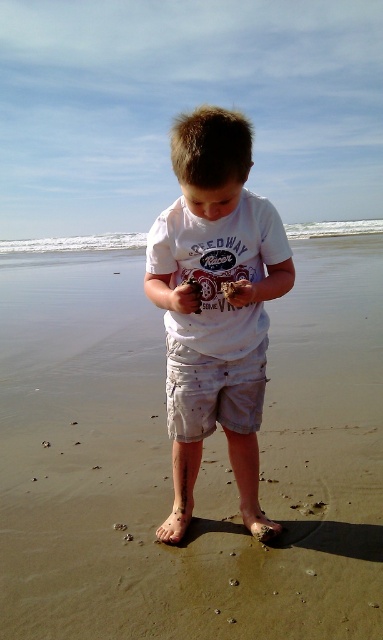
This screenshot has width=383, height=640. What do you see at coordinates (212, 392) in the screenshot?
I see `white cotton shorts at center` at bounding box center [212, 392].

At what (x,y) coordinates should I click in order to perform the action: click on white cotton shorts at center. Please return your answer as a coordinate pair (x, y). Image resolution: width=383 pixels, height=640 pixels. Looking at the image, I should click on (212, 392).

Which is in front, point (255, 353) or point (245, 305)?

Point (245, 305) is more forward.

I want to click on white cotton shorts at center, so click(x=212, y=392).

Is white cotton shirt at center wider than white cotton shorts at center?

Indeed, white cotton shirt at center has a greater width compared to white cotton shorts at center.

In order to click on white cotton shirt at center in this screenshot , I will do `click(216, 304)`.

Where is `white cotton shirt at center`? The width and height of the screenshot is (383, 640). white cotton shirt at center is located at coordinates (216, 304).

Which is behind, point (121, 548) or point (232, 372)?

Point (121, 548)

Is brown sandy beach at center shorter than white cotton shorts at center?

No, brown sandy beach at center is not shorter than white cotton shorts at center.

This screenshot has width=383, height=640. Find the location of `brown sandy beach at center`. brown sandy beach at center is located at coordinates (170, 456).